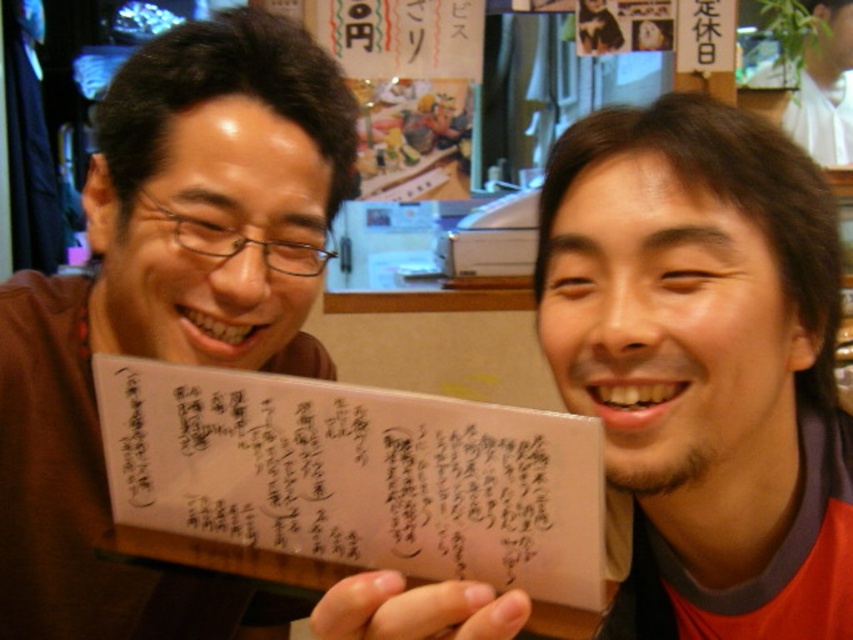
What is the object located at the coordinates point (167, 305) in the image?

The object at point (167, 305) is the matte brown card at left.

You are a delivery person who needs to place a package between the transparent paper at center and the white paper at upper right. The package is 6 feet long. Will it fit between them?

The distance between the transparent paper at center and the white paper at upper right is 7.04 feet. Since the package is 6 feet long, it will fit between them as there is enough space.